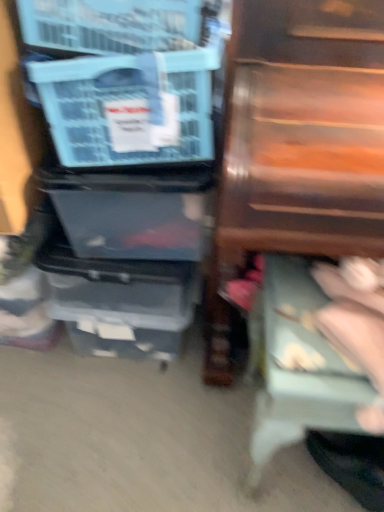
Question: Considering the relative sizes of light blue fabric step stool at lower right and blue plastic storage box at left in the image provided, is light blue fabric step stool at lower right bigger than blue plastic storage box at left?

Choices:
 (A) no
 (B) yes

Answer: (B)

Question: Is light blue fabric step stool at lower right oriented away from blue plastic storage box at left?

Choices:
 (A) yes
 (B) no

Answer: (B)

Question: Does light blue fabric step stool at lower right have a lesser width compared to blue plastic storage box at left?

Choices:
 (A) no
 (B) yes

Answer: (A)

Question: Is light blue fabric step stool at lower right at the left side of blue plastic storage box at left?

Choices:
 (A) no
 (B) yes

Answer: (A)

Question: Is light blue fabric step stool at lower right oriented towards blue plastic storage box at left?

Choices:
 (A) yes
 (B) no

Answer: (B)

Question: From a real-world perspective, is blue plastic storage box at left positioned above or below light blue fabric step stool at lower right?

Choices:
 (A) below
 (B) above

Answer: (B)

Question: Relative to light blue fabric step stool at lower right, is blue plastic storage box at left in front or behind?

Choices:
 (A) front
 (B) behind

Answer: (B)

Question: Considering the positions of blue plastic storage box at left and light blue fabric step stool at lower right in the image, is blue plastic storage box at left wider or thinner than light blue fabric step stool at lower right?

Choices:
 (A) wide
 (B) thin

Answer: (B)

Question: From the image's perspective, is blue plastic storage box at left above or below light blue fabric step stool at lower right?

Choices:
 (A) below
 (B) above

Answer: (B)

Question: In terms of width, does blue plastic storage box at left look wider or thinner when compared to wooden drawer at right?

Choices:
 (A) wide
 (B) thin

Answer: (B)

Question: From a real-world perspective, is blue plastic storage box at left physically located above or below wooden drawer at right?

Choices:
 (A) below
 (B) above

Answer: (B)

Question: Choose the correct answer: Is blue plastic storage box at left inside wooden drawer at right or outside it?

Choices:
 (A) outside
 (B) inside

Answer: (A)

Question: From the image's perspective, is blue plastic storage box at left located above or below wooden drawer at right?

Choices:
 (A) above
 (B) below

Answer: (A)

Question: Is light blue fabric step stool at lower right in front of or behind blue plastic storage box at left in the image?

Choices:
 (A) behind
 (B) front

Answer: (B)

Question: Would you say light blue fabric step stool at lower right is to the left or to the right of blue plastic storage box at left in the picture?

Choices:
 (A) right
 (B) left

Answer: (A)